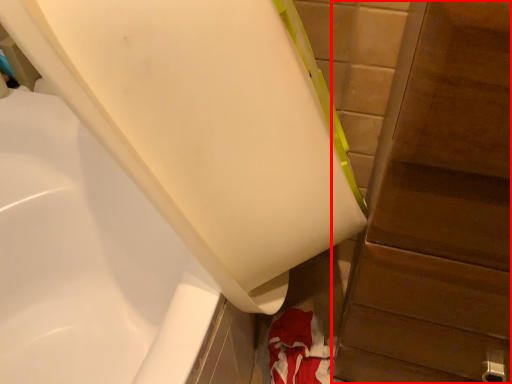
Question: Considering the relative positions of dresser (annotated by the red box) and bathtub in the image provided, where is dresser (annotated by the red box) located with respect to the staircase?

Choices:
 (A) left
 (B) right

Answer: (B)